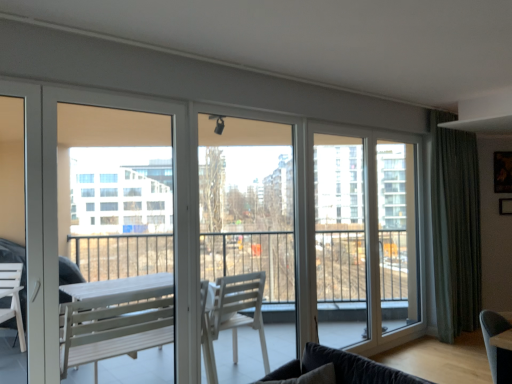
What are the coordinates of `velvet dark gray studio couch at lower right` in the screenshot? It's located at (341, 368).

From a real-world perspective, is transparent glass window at center positioned under green textured curtain at right based on gravity?

Yes, from a real-world perspective, transparent glass window at center is below green textured curtain at right.

Considering the positions of objects transparent glass window at center and green textured curtain at right in the image provided, who is more to the left, transparent glass window at center or green textured curtain at right?

transparent glass window at center.

Is transparent glass window at center inside the boundaries of green textured curtain at right, or outside?

transparent glass window at center is not inside green textured curtain at right, it's outside.

Where is `curtain above the transparent glass window at center (from the image's perspective)`? curtain above the transparent glass window at center (from the image's perspective) is located at coordinates (455, 228).

Can you confirm if transparent glass window at center is thinner than white glass screen door at center, marked as the second screen door in a left-to-right arrangement?

No, transparent glass window at center is not thinner than white glass screen door at center, marked as the second screen door in a left-to-right arrangement.

Could you tell me if transparent glass window at center is facing white glass screen door at center, marked as the second screen door in a left-to-right arrangement?

No, transparent glass window at center does not turn towards white glass screen door at center, marked as the second screen door in a left-to-right arrangement.

From the image's perspective, would you say transparent glass window at center is shown under white glass screen door at center, the first screen door in the back-to-front sequence?

No, from the image's perspective, transparent glass window at center is not below white glass screen door at center, the first screen door in the back-to-front sequence.

From a real-world perspective, does transparent glass window at center sit lower than white glass screen door at center, marked as the second screen door in a left-to-right arrangement?

No, from a real-world perspective, transparent glass window at center is not beneath white glass screen door at center, marked as the second screen door in a left-to-right arrangement.

From a real-world perspective, is white matte screen door at left, the 1th screen door viewed from the left, under velvet dark gray studio couch at lower right?

Actually, white matte screen door at left, the 1th screen door viewed from the left, is physically above velvet dark gray studio couch at lower right in the real world.

Based on the photo, between white matte screen door at left, arranged as the 1th screen door when viewed from the front, and velvet dark gray studio couch at lower right, which one has smaller size?

Smaller between the two is velvet dark gray studio couch at lower right.

Can we say white matte screen door at left, arranged as the 1th screen door when viewed from the front, lies outside velvet dark gray studio couch at lower right?

white matte screen door at left, arranged as the 1th screen door when viewed from the front, is positioned outside velvet dark gray studio couch at lower right.

Is there a large distance between white matte screen door at left, the second screen door from the right, and velvet dark gray studio couch at lower right?

Yes, white matte screen door at left, the second screen door from the right, and velvet dark gray studio couch at lower right are located far from each other.

Is point (468, 313) closer to camera compared to point (326, 266)?

No, it is not.

Considering the relative sizes of green textured curtain at right and white glass screen door at center, the first screen door in the back-to-front sequence, in the image provided, is green textured curtain at right shorter than white glass screen door at center, the first screen door in the back-to-front sequence,?

No, green textured curtain at right is not shorter than white glass screen door at center, the first screen door in the back-to-front sequence.

Which is more to the right, green textured curtain at right or white glass screen door at center, the first screen door in the back-to-front sequence?

Positioned to the right is green textured curtain at right.

Who is smaller, green textured curtain at right or white glass screen door at center, which is the second screen door from front to back?

With smaller size is white glass screen door at center, which is the second screen door from front to back.

Is white matte screen door at left, which ranks as the second screen door in back-to-front order, aimed at green textured curtain at right?

No, white matte screen door at left, which ranks as the second screen door in back-to-front order, is not oriented towards green textured curtain at right.

From a real-world perspective, is white matte screen door at left, which ranks as the second screen door in back-to-front order, located beneath green textured curtain at right?

No, from a real-world perspective, white matte screen door at left, which ranks as the second screen door in back-to-front order, is not under green textured curtain at right.

From the image's perspective, would you say white matte screen door at left, the 1th screen door viewed from the left, is positioned over green textured curtain at right?

No, from the image's perspective, white matte screen door at left, the 1th screen door viewed from the left, is not on top of green textured curtain at right.

Considering the relative sizes of white matte screen door at left, arranged as the 1th screen door when viewed from the front, and green textured curtain at right in the image provided, is white matte screen door at left, arranged as the 1th screen door when viewed from the front, smaller than green textured curtain at right?

Correct, white matte screen door at left, arranged as the 1th screen door when viewed from the front, occupies less space than green textured curtain at right.

Is green textured curtain at right positioned far away from transparent glass window at center?

That's right, there is a large distance between green textured curtain at right and transparent glass window at center.

Is green textured curtain at right turned away from transparent glass window at center?

No, green textured curtain at right is not facing the opposite direction of transparent glass window at center.

Between green textured curtain at right and transparent glass window at center, which one has smaller width?

transparent glass window at center.

Considering the relative positions of green textured curtain at right and transparent glass window at center in the image provided, is green textured curtain at right to the right of transparent glass window at center from the viewer's perspective?

Indeed, green textured curtain at right is positioned on the right side of transparent glass window at center.

Is velvet dark gray studio couch at lower right completely or partially inside transparent glass window at center?

That's incorrect, velvet dark gray studio couch at lower right is not inside transparent glass window at center.

Which is in front, point (280, 153) or point (350, 370)?

Positioned in front is point (350, 370).

Does transparent glass window at center appear on the left side of velvet dark gray studio couch at lower right?

Indeed, transparent glass window at center is positioned on the left side of velvet dark gray studio couch at lower right.

From the picture: Is transparent glass window at center turned away from velvet dark gray studio couch at lower right?

No, transparent glass window at center's orientation is not away from velvet dark gray studio couch at lower right.

I want to click on window screen below the green textured curtain at right (from a real-world perspective), so click(247, 203).

You are a GUI agent. You are given a task and a screenshot of the screen. Output one action in this format:
    pyautogui.click(x=<x>, y=<y>)
    Task: Click on the screen door located behind the transparent glass window at center
    
    Given the screenshot: What is the action you would take?
    pyautogui.click(x=365, y=238)

Estimate the real-world distances between objects in this image. Which object is closer to velvet dark gray studio couch at lower right, transparent glass window at center or white matte screen door at left, arranged as the 1th screen door when viewed from the front?

transparent glass window at center.

Considering their positions, is velvet dark gray studio couch at lower right positioned further to green textured curtain at right than transparent glass window at center?

Based on the image, velvet dark gray studio couch at lower right appears to be further to green textured curtain at right.

Estimate the real-world distances between objects in this image. Which object is closer to transparent glass window at center, white matte screen door at left, arranged as the 1th screen door when viewed from the front, or green textured curtain at right?

The object closer to transparent glass window at center is white matte screen door at left, arranged as the 1th screen door when viewed from the front.

Which object lies further to the anchor point white matte screen door at left, the 1th screen door viewed from the left, transparent glass window at center or velvet dark gray studio couch at lower right?

Among the two, velvet dark gray studio couch at lower right is located further to white matte screen door at left, the 1th screen door viewed from the left.

Looking at the image, which one is located further to velvet dark gray studio couch at lower right, white glass screen door at center, which is the second screen door from front to back, or white matte screen door at left, which ranks as the second screen door in back-to-front order?

white glass screen door at center, which is the second screen door from front to back, is further to velvet dark gray studio couch at lower right.

In the scene shown: Estimate the real-world distances between objects in this image. Which object is closer to velvet dark gray studio couch at lower right, green textured curtain at right or white glass screen door at center, the first screen door in the back-to-front sequence?

white glass screen door at center, the first screen door in the back-to-front sequence.

Considering their positions, is white matte screen door at left, the 1th screen door viewed from the left, positioned further to green textured curtain at right than white glass screen door at center, the first screen door when ordered from right to left?

Based on the image, white matte screen door at left, the 1th screen door viewed from the left, appears to be further to green textured curtain at right.

Considering their positions, is white matte screen door at left, arranged as the 1th screen door when viewed from the front, positioned closer to white glass screen door at center, the first screen door when ordered from right to left, than velvet dark gray studio couch at lower right?

Among the two, white matte screen door at left, arranged as the 1th screen door when viewed from the front, is located nearer to white glass screen door at center, the first screen door when ordered from right to left.

Identify the location of studio couch between white matte screen door at left, the second screen door from the right, and white glass screen door at center, which is the second screen door from front to back, from left to right. The image size is (512, 384). tap(341, 368).

At what (x,y) coordinates should I click in order to perform the action: click on window screen located between white matte screen door at left, which ranks as the second screen door in back-to-front order, and white glass screen door at center, the first screen door when ordered from right to left, in the left-right direction. Please return your answer as a coordinate pair (x, y). Looking at the image, I should click on (247, 203).

I want to click on window screen between white matte screen door at left, arranged as the 1th screen door when viewed from the front, and green textured curtain at right, in the horizontal direction, so click(x=247, y=203).

Find the location of `studio couch between transparent glass window at center and green textured curtain at right in the horizontal direction`. studio couch between transparent glass window at center and green textured curtain at right in the horizontal direction is located at coordinates tap(341, 368).